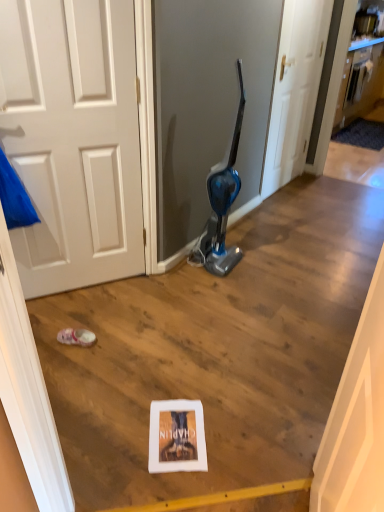
Find the location of a particular element. The height and width of the screenshot is (512, 384). free space in front of pink fabric shoe at lower left is located at coordinates (72, 366).